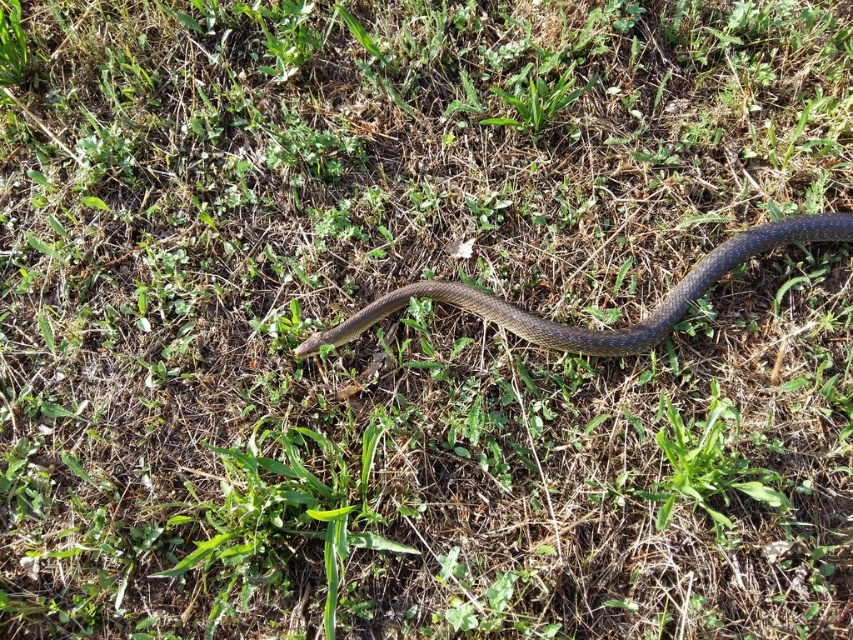
Is shiny black snake at center closer to the viewer compared to green leafy weed at upper center?

Yes.

Which is below, shiny black snake at center or green leafy weed at upper center?

Positioned lower is shiny black snake at center.

Who is more distant from viewer, (769, 230) or (538, 96)?

Point (538, 96)

You are a GUI agent. You are given a task and a screenshot of the screen. Output one action in this format:
    pyautogui.click(x=<x>, y=<y>)
    Task: Click on the shiny black snake at center
    
    Given the screenshot: What is the action you would take?
    pyautogui.click(x=592, y=330)